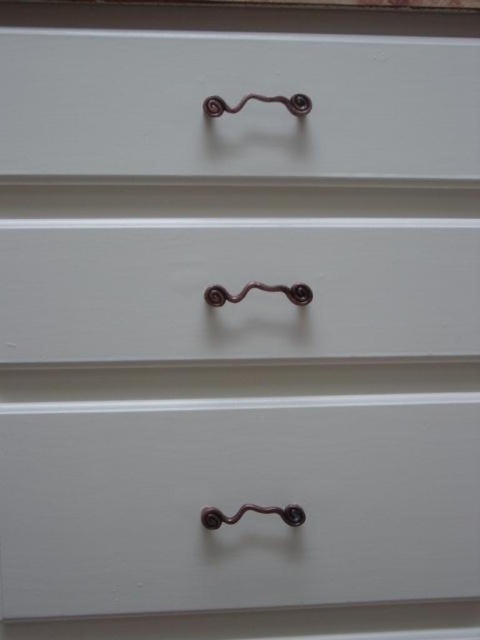
Is point (11, 134) positioned before point (17, 310)?

Yes, point (11, 134) is in front of point (17, 310).

Find the location of a particular element. The image size is (480, 640). matte brown handle at upper center is located at coordinates (235, 102).

Is white matte drawer at lower center further to camera compared to matte brown handle at upper center?

Yes.

Between point (190, 449) and point (57, 124), which one is positioned in front?

Point (57, 124) is more forward.

This screenshot has width=480, height=640. In order to click on white matte drawer at lower center in this screenshot , I will do tap(237, 502).

Is white matte drawer at lower center in front of matte white drawer at center?

No, white matte drawer at lower center is behind matte white drawer at center.

Identify the location of white matte drawer at lower center. (237, 502).